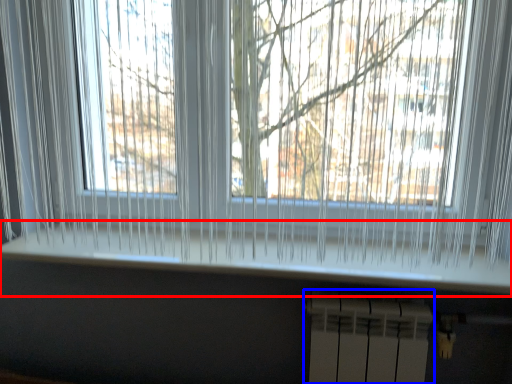
Question: Among these objects, which one is farthest to the camera, window sill (highlighted by a red box) or radiator (highlighted by a blue box)?

Choices:
 (A) window sill
 (B) radiator

Answer: (B)